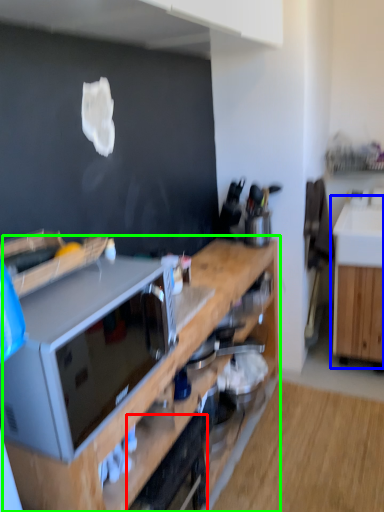
Question: Based on their relative distances, which object is nearer to appliance (highlighted by a red box)? Choose from cabinetry (highlighted by a blue box) and cabinetry (highlighted by a green box).

Choices:
 (A) cabinetry
 (B) cabinetry

Answer: (B)